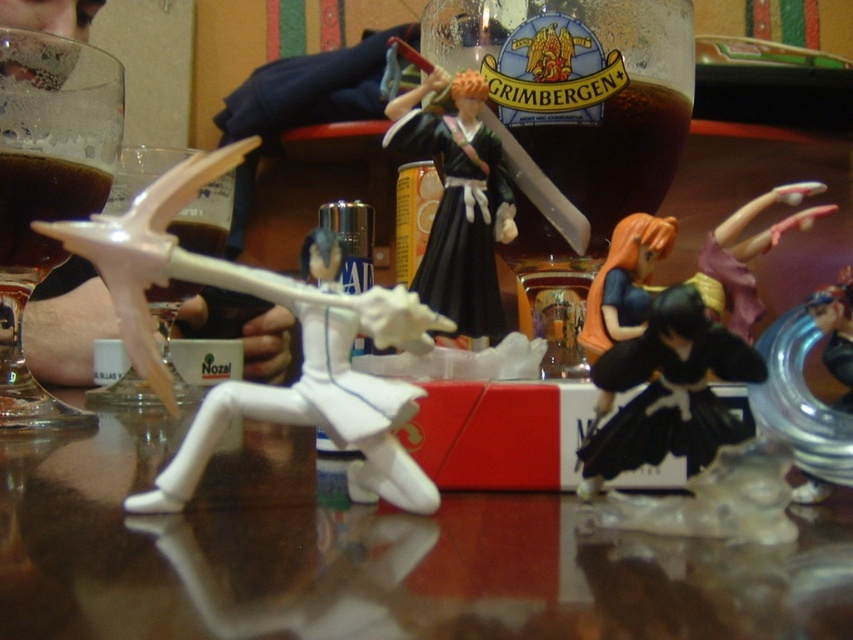
Is point (614, 348) positioned in front of point (178, 292)?

Yes, point (614, 348) is closer to viewer.

Is the position of black matte dress at center more distant than that of white plastic wine glass at left?

No, it is in front of white plastic wine glass at left.

This screenshot has height=640, width=853. I want to click on black matte dress at center, so click(666, 392).

The height and width of the screenshot is (640, 853). I want to click on black matte dress at center, so click(x=666, y=392).

In the scene shown: Does transparent glass at left have a greater height compared to black matte figure at center?

Yes.

Can you confirm if transparent glass at left is wider than black matte figure at center?

Indeed, transparent glass at left has a greater width compared to black matte figure at center.

Is point (103, 113) less distant than point (480, 182)?

No, (103, 113) is further to viewer.

Where is `transparent glass at left`? This screenshot has height=640, width=853. transparent glass at left is located at coordinates (47, 189).

Measure the distance from transparent glass at left to matte pink hair at upper right.

transparent glass at left and matte pink hair at upper right are 14.99 inches apart from each other.

Between point (15, 225) and point (721, 304), which one is positioned behind?

The point (15, 225) is more distant.

From the picture: Who is more forward, (x=45, y=244) or (x=744, y=225)?

Positioned in front is point (x=744, y=225).

The image size is (853, 640). In order to click on transparent glass at left in this screenshot , I will do `click(47, 189)`.